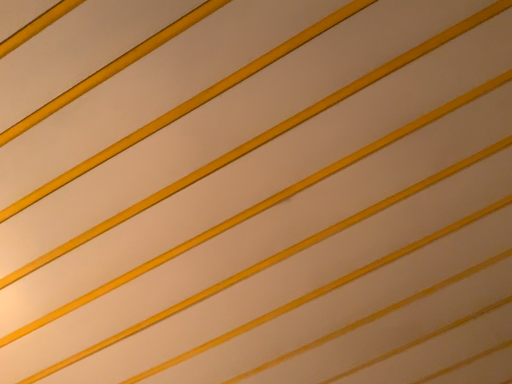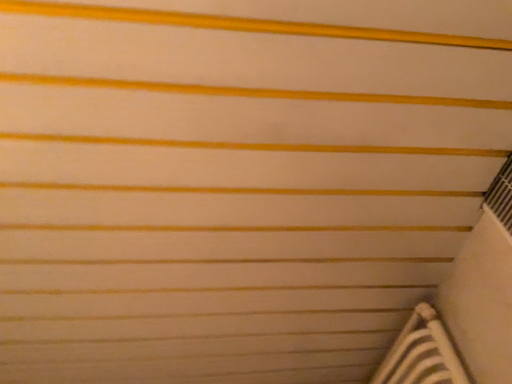
Question: How did the camera likely rotate when shooting the video?

Choices:
 (A) rotated upward
 (B) rotated downward

Answer: (B)